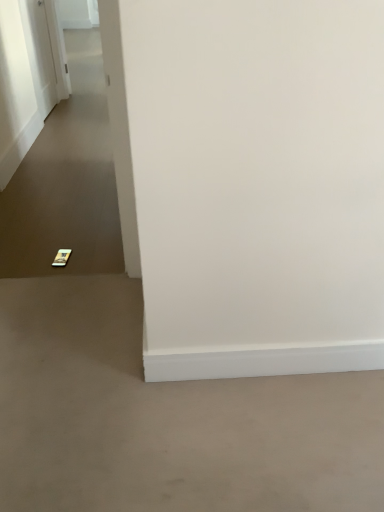
Question: Is gray matte concrete at lower left to the left or to the right of white glossy door at upper left in the image?

Choices:
 (A) left
 (B) right

Answer: (B)

Question: In terms of size, does gray matte concrete at lower left appear bigger or smaller than white glossy door at upper left?

Choices:
 (A) big
 (B) small

Answer: (A)

Question: Considering the real-world distances, which object is closest to the gold metallic phone at lower left?

Choices:
 (A) gray matte concrete at lower left
 (B) white glossy door at upper left

Answer: (B)

Question: Considering the real-world distances, which object is farthest from the white glossy door at upper left?

Choices:
 (A) gold metallic phone at lower left
 (B) gray matte concrete at lower left

Answer: (B)